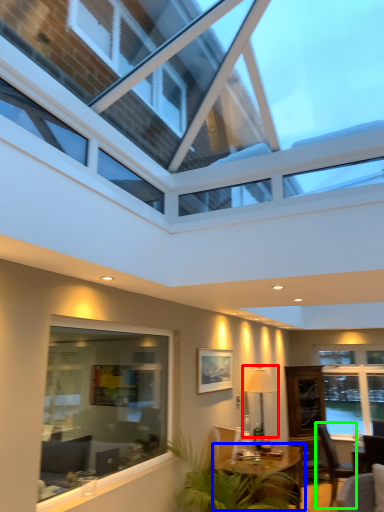
Question: Which object is positioned closest to lamp (highlighted by a red box)? Select from table (highlighted by a blue box) and chair (highlighted by a green box).

Choices:
 (A) table
 (B) chair

Answer: (A)